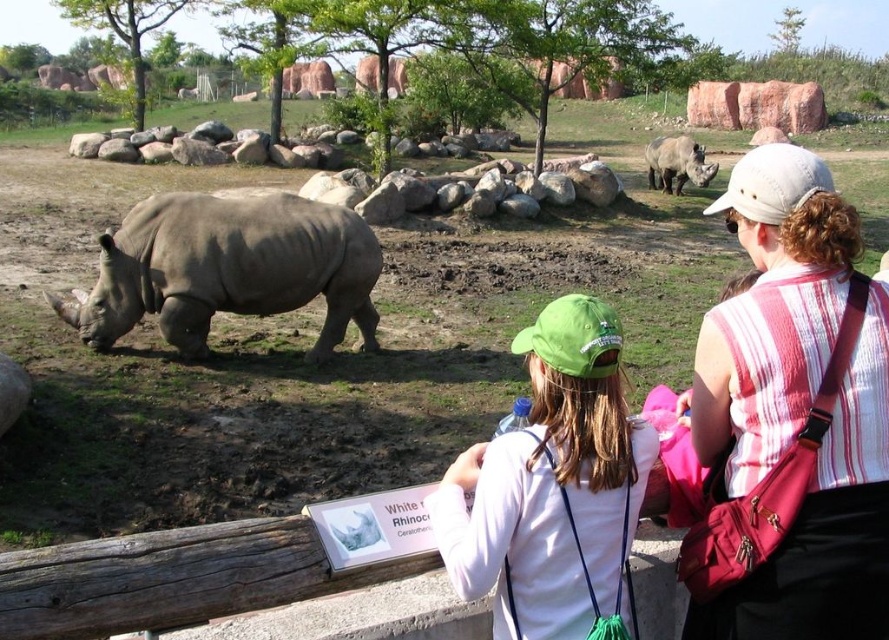
Does point (250, 240) come behind point (657, 161)?

No, (250, 240) is in front of (657, 161).

Is point (314, 266) closer to camera compared to point (686, 177)?

Yes, it is in front of point (686, 177).

Locate an element on the screen. gray matte rhinoceros at left is located at coordinates point(229,268).

Looking at this image, between striped cotton tank top at upper right and gray matte rhinoceros at center, which one is positioned lower?

striped cotton tank top at upper right is lower down.

Between point (863, 577) and point (699, 180), which one is positioned in front?

Point (863, 577) is more forward.

Locate an element on the screen. The height and width of the screenshot is (640, 889). striped cotton tank top at upper right is located at coordinates (771, 312).

Consider the image. Who is higher up, green fabric cap at center or gray matte rhinoceros at center?

gray matte rhinoceros at center is above.

You are a GUI agent. You are given a task and a screenshot of the screen. Output one action in this format:
    pyautogui.click(x=<x>, y=<y>)
    Task: Click on the green fabric cap at center
    Image resolution: width=889 pixels, height=640 pixels.
    Given the screenshot: What is the action you would take?
    point(551,484)

Which is in front, point (446, 516) or point (682, 166)?

Point (446, 516) is more forward.

Find the location of a particular element. The height and width of the screenshot is (640, 889). green fabric cap at center is located at coordinates (551, 484).